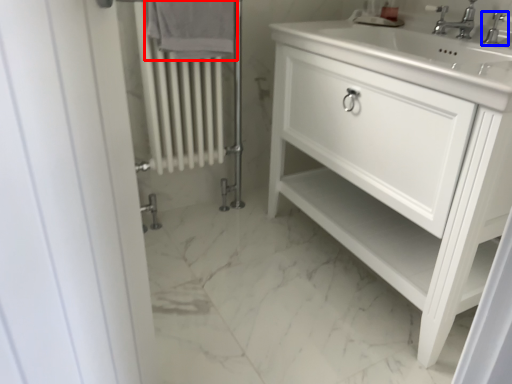
Question: Which point is further to the camera, bath towel (highlighted by a red box) or tap (highlighted by a blue box)?

Choices:
 (A) bath towel
 (B) tap

Answer: (A)